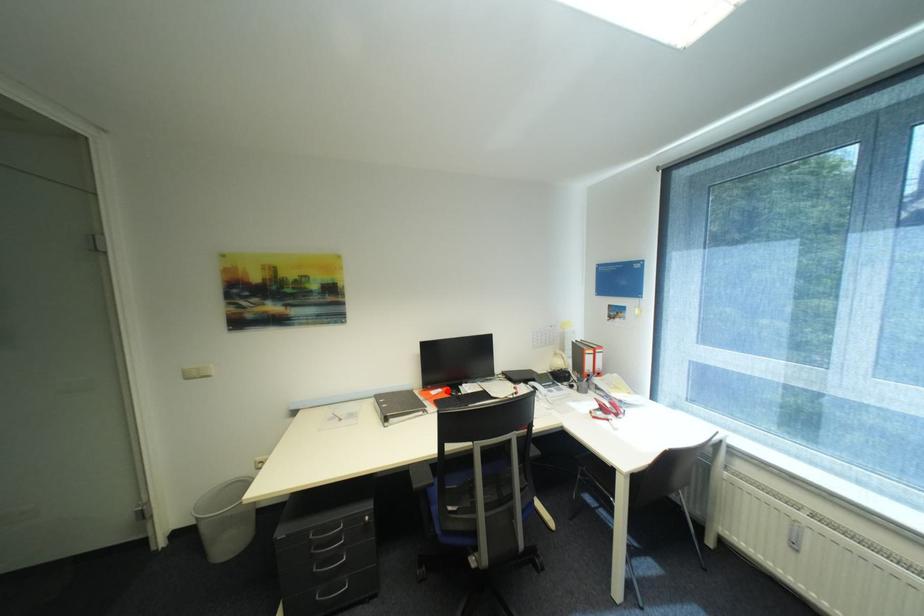
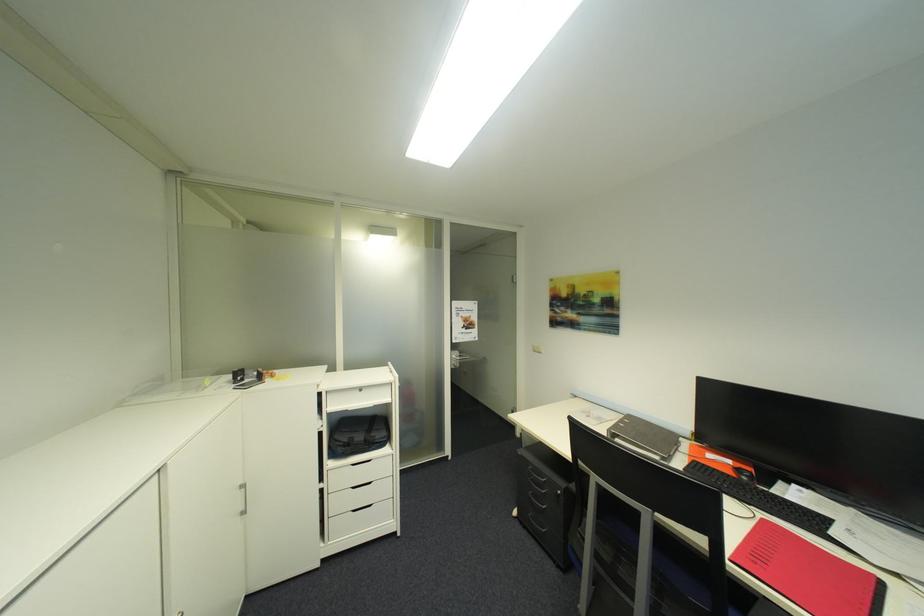
In the second image, find the point that corresponds to the highlighted location in the first image.

(736, 463)